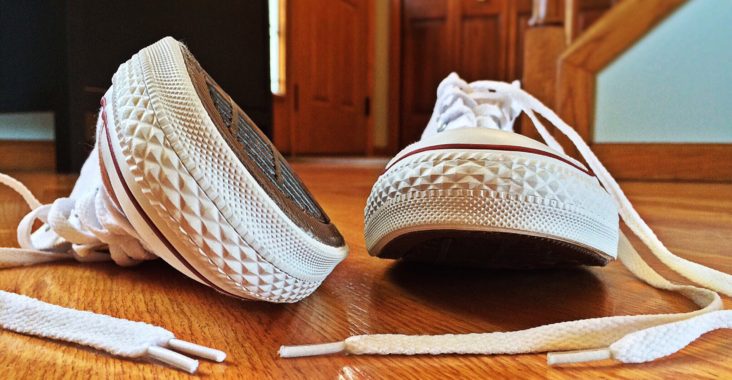
You are a GUI agent. You are given a task and a screenshot of the screen. Output one action in this format:
    pyautogui.click(x=<x>, y=<y>)
    Task: Click on the wall
    
    Given the screenshot: What is the action you would take?
    pyautogui.click(x=678, y=66)